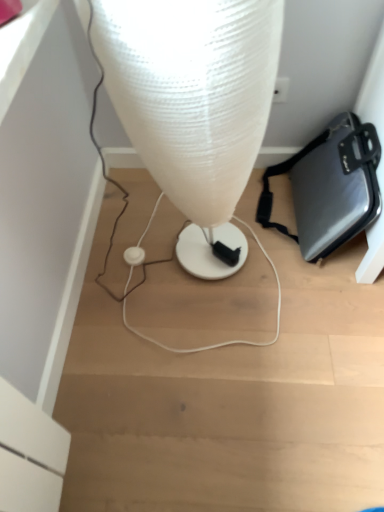
I want to click on free point below translucent plastic lamp at center (from a real-world perspective), so click(199, 273).